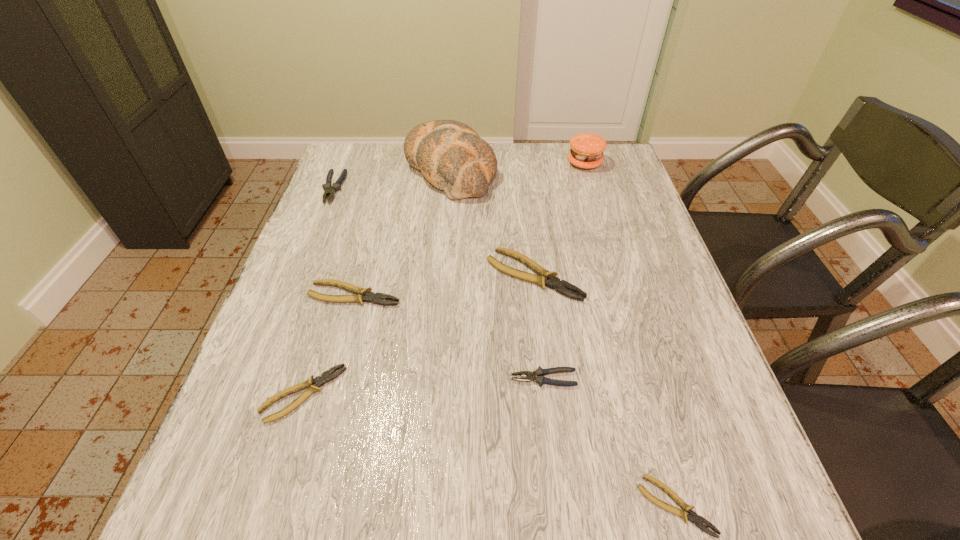
What are the coordinates of `the tallest object` in the screenshot? It's located at (450, 154).

Where is `patty`? patty is located at coordinates (587, 149).

At what (x,y) coordinates should I click in order to perform the action: click on the farthest pliers. Please return your answer as a coordinate pair (x, y). This screenshot has width=960, height=540. Looking at the image, I should click on (330, 191).

I want to click on the left gray pliers, so click(330, 191).

The height and width of the screenshot is (540, 960). What are the coordinates of `the third yellow pliers from left to right` in the screenshot? It's located at (544, 278).

You are a GUI agent. You are given a task and a screenshot of the screen. Output one action in this format:
    pyautogui.click(x=<x>, y=<y>)
    Task: Click on the third smallest yellow pliers
    The height and width of the screenshot is (540, 960).
    Given the screenshot: What is the action you would take?
    pyautogui.click(x=363, y=294)

The width and height of the screenshot is (960, 540). In order to click on the right gray pliers in this screenshot , I will do `click(540, 373)`.

Identify the location of the smaller gray pliers. The height and width of the screenshot is (540, 960). (540, 373).

The image size is (960, 540). Identify the location of the third farthest yellow pliers. (319, 381).

Identify the location of the third biggest yellow pliers. The image size is (960, 540). (319, 381).